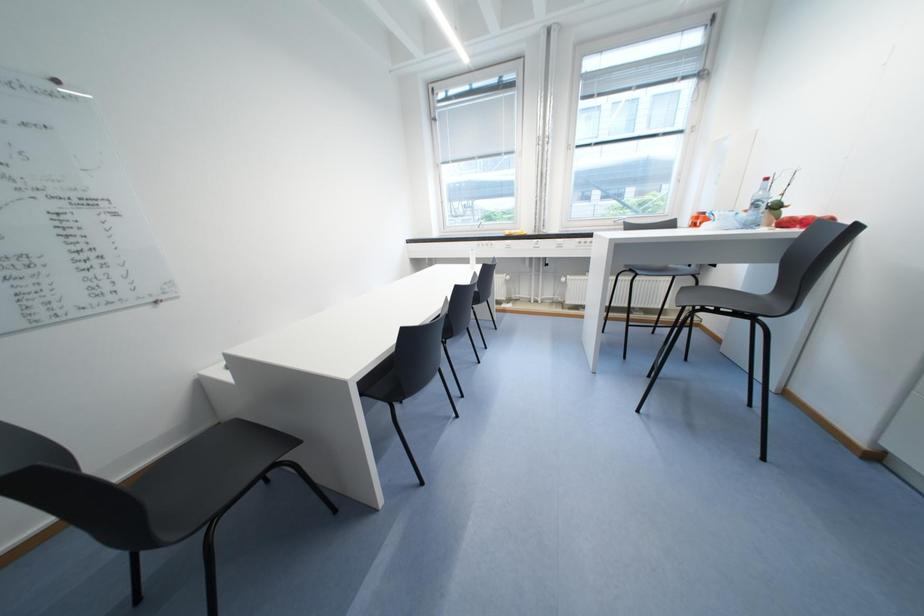
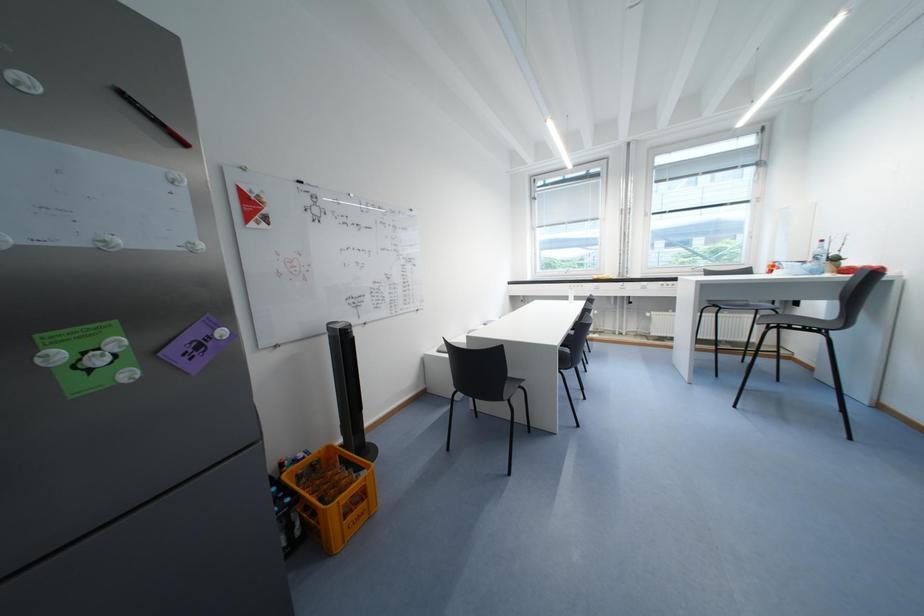
What movement of the cameraman would produce the second image?

The cameraman walked toward left, backward.